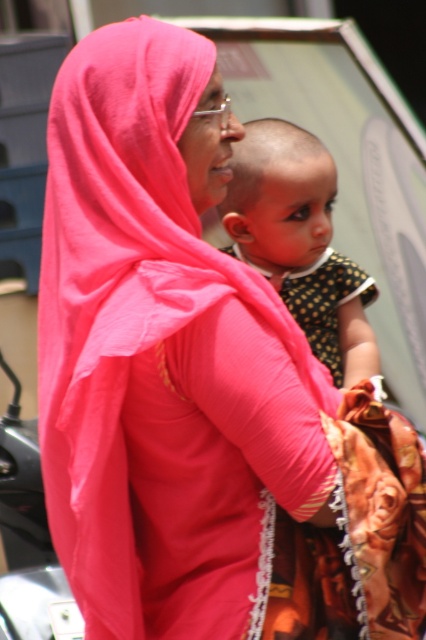
You are a photographer adjusting the camera focus. The matte pink scarf at center and the polka dot fabric baby at center are both in the frame. Which object should you focus on first if you want to ensure the wider object is sharp?

The matte pink scarf at center is wider than the polka dot fabric baby at center, so you should focus on the matte pink scarf at center first to ensure the wider object is sharp.

You are a photographer who needs to capture a closeup shot of both the matte pink scarf at center and the polka dot fabric baby at center. Given that your camera has a depth of field that can focus on objects within a 1.5 meters range, will you be able to get both subjects in focus?

The matte pink scarf at center and polka dot fabric baby at center are 1.53 meters apart. Since the distance between them exceeds the camera lens depth of field range of 1.5 meters, both subjects cannot be in focus simultaneously.

You are a photographer trying to capture a closeup of the matte pink scarf at center and the polka dot fabric baby at center. Since the camera can only focus on one object at a time, which object should you focus on first to ensure it fills the frame properly?

The matte pink scarf at center is bigger than the polka dot fabric baby at center, so you should focus on the matte pink scarf at center first to ensure it fills the frame properly.